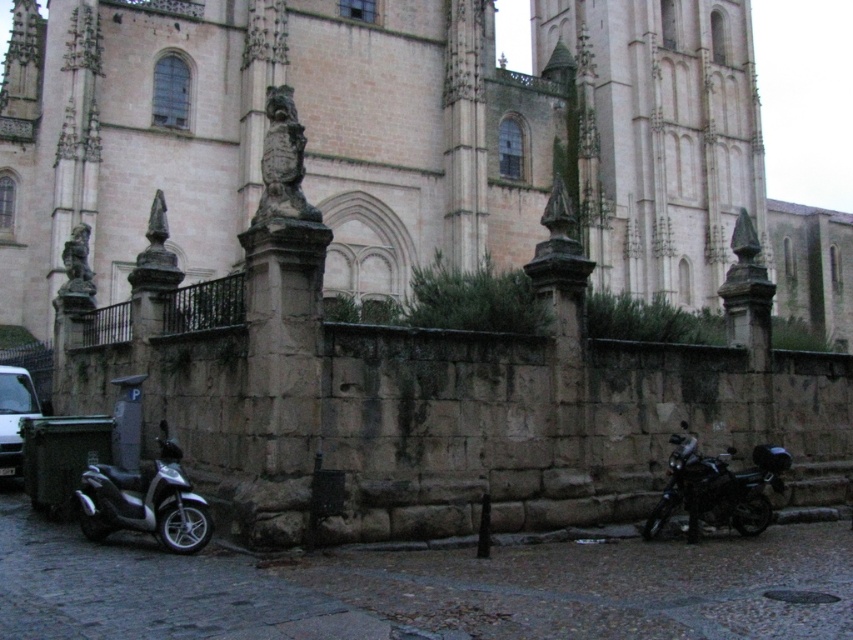
You are standing in front of the historic stone building and want to determine the relative positions of two points marked on the facade. Which point, point (196, 548) or point (15, 404), is closer to you?

Point (196, 548) is closer to the viewer than point (15, 404).